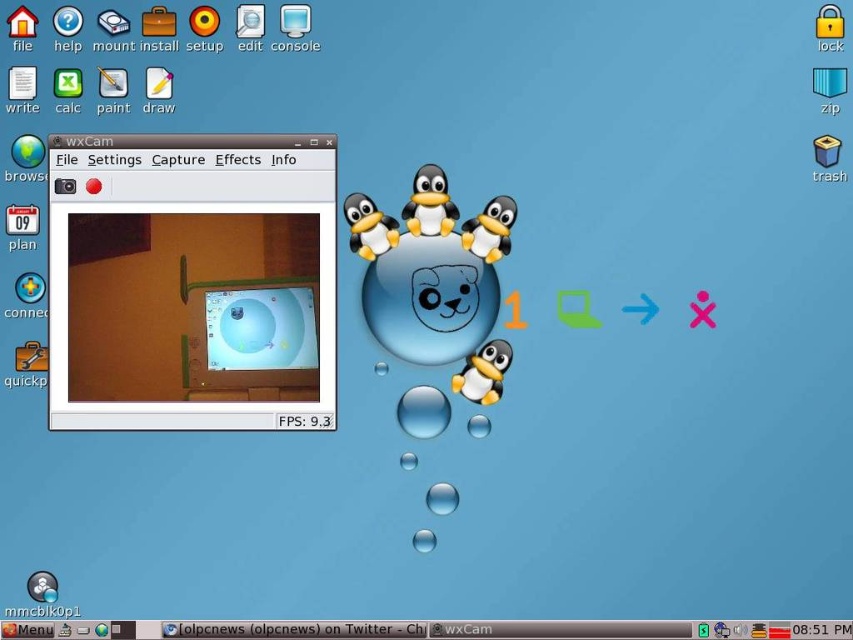
Is matte black penguin at lower center in front of transparent glass bubble at center?

Yes, matte black penguin at lower center is in front of transparent glass bubble at center.

Who is more forward, (459,392) or (426,428)?

Point (459,392)

The image size is (853, 640). In order to click on matte black penguin at lower center in this screenshot , I will do `click(483, 372)`.

Does matte black penguin at upper center appear on the right side of matte black penguin at lower center?

Incorrect, matte black penguin at upper center is not on the right side of matte black penguin at lower center.

Consider the image. Is matte black penguin at upper center above matte black penguin at lower center?

Correct, matte black penguin at upper center is located above matte black penguin at lower center.

Which is behind, point (416, 173) or point (466, 384)?

Positioned behind is point (466, 384).

Where is `matte black penguin at upper center`? This screenshot has width=853, height=640. matte black penguin at upper center is located at coordinates (428, 204).

Can you confirm if matte black penguin at upper center is positioned below matte plastic penguin at center?

Answer: No.

Does matte black penguin at upper center have a greater width compared to matte plastic penguin at center?

Incorrect, matte black penguin at upper center's width does not surpass matte plastic penguin at center's.

Is point (424, 192) behind point (461, 240)?

No, it is not.

You are a GUI agent. You are given a task and a screenshot of the screen. Output one action in this format:
    pyautogui.click(x=<x>, y=<y>)
    Task: Click on the matte black penguin at upper center
    The height and width of the screenshot is (640, 853).
    Given the screenshot: What is the action you would take?
    pyautogui.click(x=428, y=204)